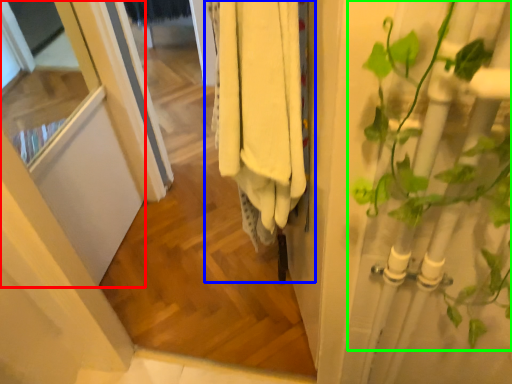
Question: Estimate the real-world distances between objects in this image. Which object is farther from screen door (highlighted by a red box), closet (highlighted by a blue box) or houseplant (highlighted by a green box)?

Choices:
 (A) closet
 (B) houseplant

Answer: (B)